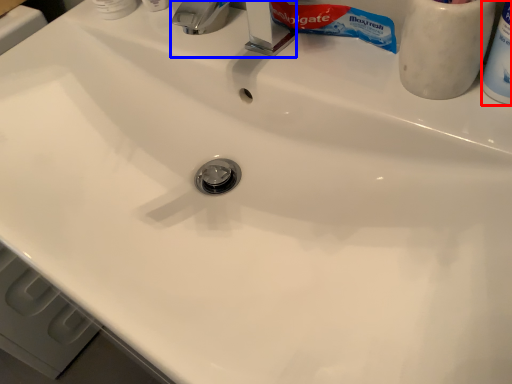
Question: Which point is closer to the camera, toiletry (highlighted by a red box) or faucet (highlighted by a blue box)?

Choices:
 (A) toiletry
 (B) faucet

Answer: (A)